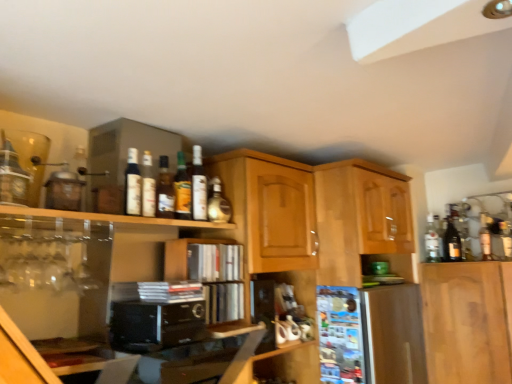
The height and width of the screenshot is (384, 512). What do you see at coordinates (432, 242) in the screenshot?
I see `clear glass bottle at right, placed as the 7th bottle when sorted from front to back` at bounding box center [432, 242].

The image size is (512, 384). What do you see at coordinates (183, 256) in the screenshot?
I see `wooden cabinet at center, arranged as the third cabinetry when viewed from the right` at bounding box center [183, 256].

Image resolution: width=512 pixels, height=384 pixels. Find the location of `clear glass bottle at right, placed as the 7th bottle when sorted from front to back`. clear glass bottle at right, placed as the 7th bottle when sorted from front to back is located at coordinates (432, 242).

Is matte glass bottle at upper center, which ranks as the 4th bottle in right-to-left order, facing away from clear glass bottle at right, placed as the 7th bottle when sorted from front to back?

No, clear glass bottle at right, placed as the 7th bottle when sorted from front to back, is not at the back of matte glass bottle at upper center, which ranks as the 4th bottle in right-to-left order.

Which is in front, matte glass bottle at upper center, which ranks as the 4th bottle in right-to-left order, or clear glass bottle at right, placed as the 7th bottle when sorted from front to back?

matte glass bottle at upper center, which ranks as the 4th bottle in right-to-left order, is closer to the camera.

From the picture: Does matte glass bottle at upper center, which ranks as the 4th bottle in right-to-left order, touch clear glass bottle at right, placed as the 7th bottle when sorted from front to back?

matte glass bottle at upper center, which ranks as the 4th bottle in right-to-left order, is not next to clear glass bottle at right, placed as the 7th bottle when sorted from front to back, and they're not touching.

Locate an element on the screen. The height and width of the screenshot is (384, 512). the 3rd bottle counting from the right of the matte glass bottle at upper center, placed as the 4th bottle when sorted from left to right is located at coordinates click(432, 242).

Could you tell me if translucent glass bottle at center, which ranks as the fifth bottle in right-to-left order, is facing matte glass bottle at upper center, the second bottle positioned from the back?

No, translucent glass bottle at center, which ranks as the fifth bottle in right-to-left order, does not turn towards matte glass bottle at upper center, the second bottle positioned from the back.

In terms of size, does translucent glass bottle at center, which ranks as the fifth bottle in right-to-left order, appear bigger or smaller than matte glass bottle at upper center, the second bottle in the right-to-left sequence?

In the image, translucent glass bottle at center, which ranks as the fifth bottle in right-to-left order, appears to be smaller than matte glass bottle at upper center, the second bottle in the right-to-left sequence.

From the picture: Between translucent glass bottle at center, the third bottle when ordered from left to right, and matte glass bottle at upper center, the sixth bottle in the left-to-right sequence, which one appears on the left side from the viewer's perspective?

translucent glass bottle at center, the third bottle when ordered from left to right, is more to the left.

Looking at this image, looking at their sizes, would you say translucent glass bottle at center, the third bottle when ordered from left to right, is wider or thinner than matte glass bottle at upper center, the second bottle positioned from the back?

In the image, translucent glass bottle at center, the third bottle when ordered from left to right, appears to be more narrow than matte glass bottle at upper center, the second bottle positioned from the back.

Based on the photo, from a real-world perspective, which object stands above the other?

matte glass bottle at upper center, the sixth bottle from the back.

In terms of height, does matte glass bottle at upper center, the sixth bottle from the back, look taller or shorter compared to matte glass bottle at upper left, placed as the 7th bottle when sorted from back to front?

Considering their sizes, matte glass bottle at upper center, the sixth bottle from the back, has more height than matte glass bottle at upper left, placed as the 7th bottle when sorted from back to front.

Does point (147, 155) come farther from viewer compared to point (139, 182)?

That is True.

Could you measure the distance between matte glass bottle at upper center, placed as the second bottle when sorted from front to back, and matte glass bottle at upper left, the first bottle in the left-to-right sequence?

A distance of 1.48 inches exists between matte glass bottle at upper center, placed as the second bottle when sorted from front to back, and matte glass bottle at upper left, the first bottle in the left-to-right sequence.

Is matte glass bottle at upper center, the second bottle in the right-to-left sequence, wider than wooden cabinet at upper center, the second cabinetry in the right-to-left sequence?

No, matte glass bottle at upper center, the second bottle in the right-to-left sequence, is not wider than wooden cabinet at upper center, the second cabinetry in the right-to-left sequence.

Is matte glass bottle at upper center, the second bottle in the right-to-left sequence, facing towards wooden cabinet at upper center, the second cabinetry in the right-to-left sequence?

No, matte glass bottle at upper center, the second bottle in the right-to-left sequence, does not turn towards wooden cabinet at upper center, the second cabinetry in the right-to-left sequence.

Between matte glass bottle at upper center, the second bottle positioned from the back, and wooden cabinet at upper center, the second cabinetry in the right-to-left sequence, which one appears on the left side from the viewer's perspective?

From the viewer's perspective, matte glass bottle at upper center, the second bottle positioned from the back, appears more on the left side.

Between matte glass bottle at upper center, the sixth bottle in the left-to-right sequence, and wooden cabinet at upper center, marked as the 2th cabinetry in a left-to-right arrangement, which one is positioned behind?

matte glass bottle at upper center, the sixth bottle in the left-to-right sequence, is further away from the camera.

Is translucent glass bottle at center, which ranks as the fifth bottle in right-to-left order, oriented towards wooden cabinet at center, arranged as the third cabinetry when viewed from the right?

No, translucent glass bottle at center, which ranks as the fifth bottle in right-to-left order, is not turned towards wooden cabinet at center, arranged as the third cabinetry when viewed from the right.

Can we say translucent glass bottle at center, which is counted as the 3th bottle, starting from the front, lies outside wooden cabinet at center, the first cabinetry positioned from the left?

translucent glass bottle at center, which is counted as the 3th bottle, starting from the front, lies outside wooden cabinet at center, the first cabinetry positioned from the left,'s area.

From the image's perspective, which one is positioned lower, translucent glass bottle at center, which is counted as the 3th bottle, starting from the front, or wooden cabinet at center, the first cabinetry positioned from the left?

wooden cabinet at center, the first cabinetry positioned from the left, from the image's perspective.

Considering the sizes of objects translucent glass bottle at center, the third bottle when ordered from left to right, and wooden cabinet at center, the first cabinetry positioned from the left, in the image provided, who is wider, translucent glass bottle at center, the third bottle when ordered from left to right, or wooden cabinet at center, the first cabinetry positioned from the left,?

wooden cabinet at center, the first cabinetry positioned from the left, is wider.

From a real-world perspective, is clear glass bottle at right, which is the first bottle in right-to-left order, located beneath matte glass bottle at upper center, the sixth bottle in the right-to-left sequence?

Indeed, from a real-world perspective, clear glass bottle at right, which is the first bottle in right-to-left order, is positioned beneath matte glass bottle at upper center, the sixth bottle in the right-to-left sequence.

Where is `the 3rd bottle positioned below the matte glass bottle at upper center, the sixth bottle from the back (from a real-world perspective)`? The image size is (512, 384). the 3rd bottle positioned below the matte glass bottle at upper center, the sixth bottle from the back (from a real-world perspective) is located at coordinates (432, 242).

Between clear glass bottle at right, which appears as the first bottle when viewed from the back, and matte glass bottle at upper center, placed as the second bottle when sorted from front to back, which one has smaller width?

matte glass bottle at upper center, placed as the second bottle when sorted from front to back, is thinner.

Which of these two, matte glass bottle at upper center, the third bottle when ordered from right to left, or matte glass bottle at upper center, which ranks as the 4th bottle in right-to-left order, stands shorter?

Standing shorter between the two is matte glass bottle at upper center, which ranks as the 4th bottle in right-to-left order.

Is matte glass bottle at upper center, which appears as the third bottle when viewed from the back, positioned before matte glass bottle at upper center, marked as the 4th bottle in a back-to-front arrangement?

No, matte glass bottle at upper center, which appears as the third bottle when viewed from the back, is further to the viewer.

Measure the distance between matte glass bottle at upper center, which appears as the third bottle when viewed from the back, and matte glass bottle at upper center, which ranks as the 4th bottle in right-to-left order.

The distance of matte glass bottle at upper center, which appears as the third bottle when viewed from the back, from matte glass bottle at upper center, which ranks as the 4th bottle in right-to-left order, is 3.91 centimeters.

Can you confirm if matte glass bottle at upper center, the third bottle when ordered from right to left, is thinner than matte glass bottle at upper center, marked as the 4th bottle in a back-to-front arrangement?

In fact, matte glass bottle at upper center, the third bottle when ordered from right to left, might be wider than matte glass bottle at upper center, marked as the 4th bottle in a back-to-front arrangement.

Image resolution: width=512 pixels, height=384 pixels. Find the location of `the 4th bottle positioned below the matte glass bottle at upper center, which appears as the 4th bottle when viewed from the front (from a real-world perspective)`. the 4th bottle positioned below the matte glass bottle at upper center, which appears as the 4th bottle when viewed from the front (from a real-world perspective) is located at coordinates (432, 242).

Identify the location of the 3rd bottle to the right of the translucent glass bottle at center, which is the 5th bottle from back to front, counting from the anchor's position. (218, 203).

Estimate the real-world distances between objects in this image. Which object is further from matte glass bottle at upper center, the second bottle positioned from the back, matte glass bottle at upper center, placed as the 4th bottle when sorted from left to right, or wooden cabinet at upper center, the second cabinetry in the right-to-left sequence?

wooden cabinet at upper center, the second cabinetry in the right-to-left sequence.

When comparing their distances from matte glass bottle at upper center, the sixth bottle from the back, does clear glass bottle at right, which appears as the first bottle when viewed from the back, or matte glass bottle at upper left, the first bottle in the left-to-right sequence, seem further?

The object further to matte glass bottle at upper center, the sixth bottle from the back, is clear glass bottle at right, which appears as the first bottle when viewed from the back.

From the image, which object appears to be farther from matte glass bottle at upper center, which appears as the third bottle when viewed from the back, translucent glass bottle at center, the third bottle when ordered from left to right, or matte glass bottle at upper left, placed as the 7th bottle when sorted from back to front?

matte glass bottle at upper left, placed as the 7th bottle when sorted from back to front, is further to matte glass bottle at upper center, which appears as the third bottle when viewed from the back.

Looking at the image, which one is located closer to glossy wood cabinet at upper right, the first cabinetry viewed from the right, matte glass bottle at upper center, which ranks as the 4th bottle in right-to-left order, or wooden cabinet at center, arranged as the third cabinetry when viewed from the right?

wooden cabinet at center, arranged as the third cabinetry when viewed from the right, lies closer to glossy wood cabinet at upper right, the first cabinetry viewed from the right, than the other object.

Estimate the real-world distances between objects in this image. Which object is further from matte glass bottle at upper center, which ranks as the 4th bottle in right-to-left order, matte glass bottle at upper center, the third bottle when ordered from right to left, or matte glass bottle at upper left, the first bottle in the left-to-right sequence?

The object further to matte glass bottle at upper center, which ranks as the 4th bottle in right-to-left order, is matte glass bottle at upper left, the first bottle in the left-to-right sequence.

Estimate the real-world distances between objects in this image. Which object is closer to wooden cabinet at upper center, marked as the 2th cabinetry in a left-to-right arrangement, clear glass bottle at right, arranged as the seventh bottle when viewed from the left, or black matte microwave at center?

Among the two, black matte microwave at center is located nearer to wooden cabinet at upper center, marked as the 2th cabinetry in a left-to-right arrangement.

Based on their spatial positions, is matte glass bottle at upper center, placed as the second bottle when sorted from front to back, or matte glass bottle at upper center, marked as the 4th bottle in a back-to-front arrangement, closer to wooden cabinet at center, the first cabinetry positioned from the left?

matte glass bottle at upper center, marked as the 4th bottle in a back-to-front arrangement, is closer to wooden cabinet at center, the first cabinetry positioned from the left.

Looking at the image, which one is located closer to matte glass bottle at upper center, placed as the 4th bottle when sorted from left to right, translucent glass bottle at center, the third bottle when ordered from left to right, or glossy wood cabinet at upper right, the first cabinetry viewed from the right?

Among the two, translucent glass bottle at center, the third bottle when ordered from left to right, is located nearer to matte glass bottle at upper center, placed as the 4th bottle when sorted from left to right.

Where is `appliance between translucent glass bottle at center, which ranks as the fifth bottle in right-to-left order, and clear glass bottle at right, arranged as the seventh bottle when viewed from the left, from left to right`? appliance between translucent glass bottle at center, which ranks as the fifth bottle in right-to-left order, and clear glass bottle at right, arranged as the seventh bottle when viewed from the left, from left to right is located at coordinates (155, 325).

Locate an element on the screen. The width and height of the screenshot is (512, 384). bottle positioned between matte glass bottle at upper center, placed as the second bottle when sorted from front to back, and matte glass bottle at upper center, marked as the 4th bottle in a back-to-front arrangement, from near to far is located at coordinates click(164, 190).

What are the coordinates of `cabinetry located between black matte microwave at center and wooden cabinet at upper center, the second cabinetry in the right-to-left sequence, in the depth direction` in the screenshot? It's located at (183, 256).

This screenshot has height=384, width=512. Identify the location of appliance between matte glass bottle at upper left, the 7th bottle from the right, and clear glass bottle at right, placed as the 7th bottle when sorted from front to back, from left to right. (155, 325).